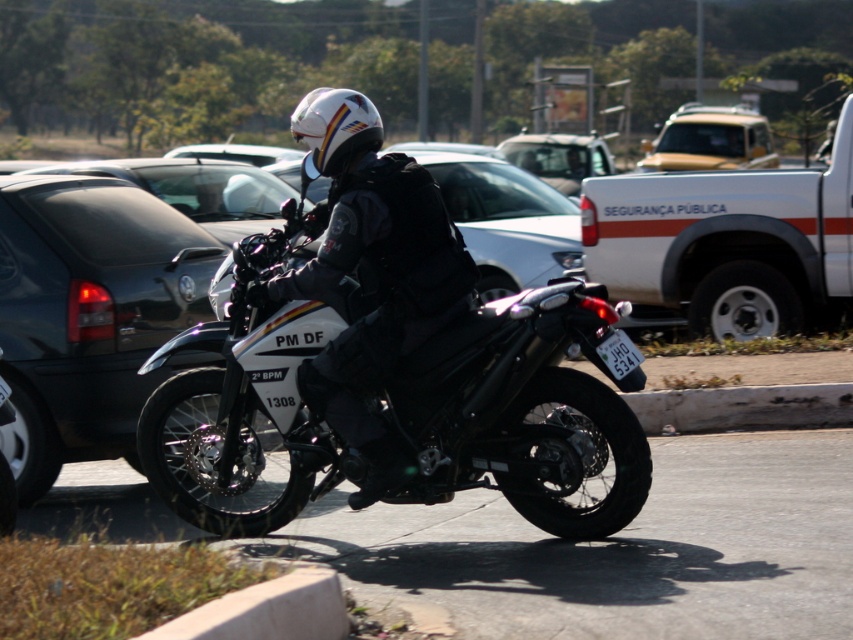
Question: From the image, what is the correct spatial relationship of white matte ambulance at center in relation to black plastic license plate at center?

Choices:
 (A) right
 (B) left

Answer: (A)

Question: Among these objects, which one is nearest to the camera?

Choices:
 (A) metallic black motorcycle at center
 (B) white matte ambulance at center

Answer: (A)

Question: Which point is closer to the camera?

Choices:
 (A) metallic black motorcycle at center
 (B) white glossy helmet at center

Answer: (A)

Question: Is metallic black motorcycle at center below white glossy helmet at center?

Choices:
 (A) yes
 (B) no

Answer: (A)

Question: Does black matte helmet at center have a greater width compared to white glossy helmet at center?

Choices:
 (A) no
 (B) yes

Answer: (B)

Question: Considering the real-world distances, which object is closest to the black plastic license plate at center?

Choices:
 (A) white glossy helmet at center
 (B) metallic black motorcycle at center
 (C) black matte helmet at center

Answer: (C)